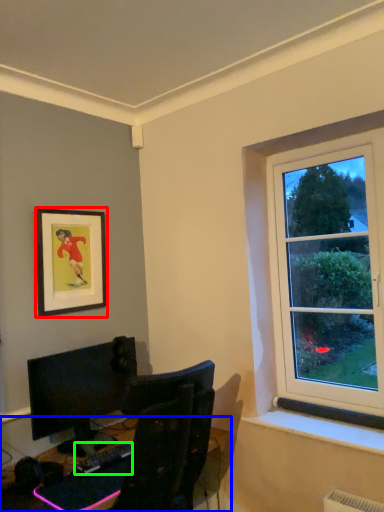
Question: Which object is the closest to the picture frame (highlighted by a red box)? Choose among these: desk (highlighted by a blue box) or computer keyboard (highlighted by a green box).

Choices:
 (A) desk
 (B) computer keyboard

Answer: (A)